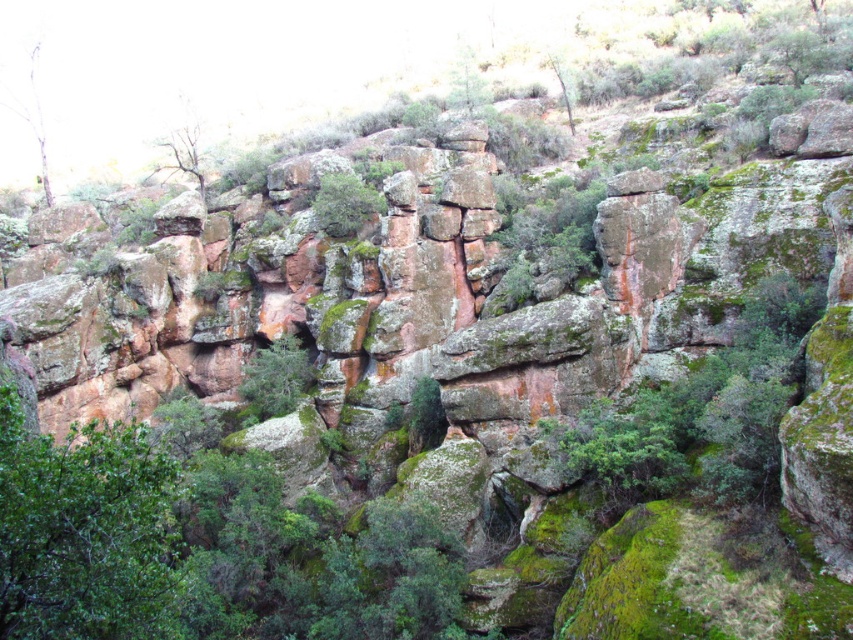
You are a hiker trying to navigate through this rocky terrain. You notice the green leafy tree at lower left and the green mossy rock at upper center. Which of these two landmarks is bigger in size?

The green leafy tree at lower left is larger in size than the green mossy rock at upper center, so the tree is bigger.

You are a hiker who wants to place a small tent between the green mossy tree at upper left and the green mossy rock at upper center. Based on their widths, can you determine if the space between them is wide enough to fit the tent?

The green mossy tree at upper left might be wider than green mossy rock at upper center, so the space between them could accommodate a small tent depending on their actual widths.

You are standing in the rugged rocky landscape and want to reach the point marked as point [192,131]. If your walking speed is 1.5 meters per second, how long will it take you to reach that point?

The point [192,131] is 83.84 meters away from the viewer. At a walking speed of 1.5 meters per second, it will take approximately 55.89 seconds to reach the point.